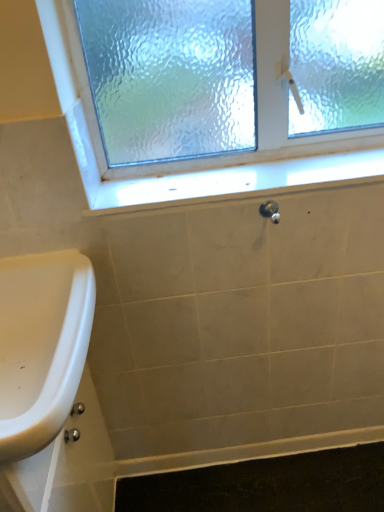
What are the coordinates of `frosted glass window at upper center` in the screenshot? It's located at (213, 158).

What do you see at coordinates (41, 345) in the screenshot?
I see `white glossy sink at lower left` at bounding box center [41, 345].

You are a GUI agent. You are given a task and a screenshot of the screen. Output one action in this format:
    pyautogui.click(x=<x>, y=<y>)
    Task: Click on the white glossy sink at lower left
    
    Given the screenshot: What is the action you would take?
    pyautogui.click(x=41, y=345)

Identify the location of black rubber bath mat at lower center. The height and width of the screenshot is (512, 384). (266, 485).

Is frosted glass window at upper center far away from black rubber bath mat at lower center?

That's right, there is a large distance between frosted glass window at upper center and black rubber bath mat at lower center.

Looking at this image, measure the distance from frosted glass window at upper center to black rubber bath mat at lower center.

They are 1.07 meters apart.

Considering the relative positions of frosted glass window at upper center and black rubber bath mat at lower center in the image provided, is frosted glass window at upper center to the left or to the right of black rubber bath mat at lower center?

frosted glass window at upper center is positioned on black rubber bath mat at lower center's left side.

In terms of height, does frosted glass window at upper center look taller or shorter compared to black rubber bath mat at lower center?

Clearly, frosted glass window at upper center is taller compared to black rubber bath mat at lower center.

Is white glossy sink at lower left completely or partially inside white glossy window sill at center?

No, white glossy sink at lower left is located outside of white glossy window sill at center.

How many degrees apart are the facing directions of white glossy window sill at center and white glossy sink at lower left?

90.4 degrees.

Considering the positions of objects white glossy window sill at center and white glossy sink at lower left in the image provided, who is more to the right, white glossy window sill at center or white glossy sink at lower left?

Positioned to the right is white glossy window sill at center.

Is black rubber bath mat at lower center touching white glossy window sill at center?

No, black rubber bath mat at lower center is not touching white glossy window sill at center.

In terms of size, does black rubber bath mat at lower center appear bigger or smaller than white glossy window sill at center?

Considering their sizes, black rubber bath mat at lower center takes up more space than white glossy window sill at center.

Considering the sizes of objects black rubber bath mat at lower center and white glossy window sill at center in the image provided, who is shorter, black rubber bath mat at lower center or white glossy window sill at center?

white glossy window sill at center is shorter.

Based on the photo, considering the sizes of satin nickel knob at center and frosted glass window at upper center in the image, is satin nickel knob at center bigger or smaller than frosted glass window at upper center?

satin nickel knob at center is smaller than frosted glass window at upper center.

From a real-world perspective, is satin nickel knob at center located higher than frosted glass window at upper center?

No, from a real-world perspective, satin nickel knob at center is not above frosted glass window at upper center.

From the image's perspective, between satin nickel knob at center and frosted glass window at upper center, who is located below?

satin nickel knob at center appears lower in the image.

Can you confirm if black rubber bath mat at lower center is wider than satin nickel knob at center?

Correct, the width of black rubber bath mat at lower center exceeds that of satin nickel knob at center.

Is black rubber bath mat at lower center turned away from satin nickel knob at center?

That's not correct — black rubber bath mat at lower center is not looking away from satin nickel knob at center.

Is point (230, 475) closer or farther from the camera than point (267, 214)?

Clearly, point (230, 475) is more distant from the camera than point (267, 214).

From their relative heights in the image, would you say black rubber bath mat at lower center is taller or shorter than satin nickel knob at center?

Clearly, black rubber bath mat at lower center is shorter compared to satin nickel knob at center.

From the image's perspective, is frosted glass window at upper center positioned above or below satin nickel knob at center?

Clearly, from the image's perspective, frosted glass window at upper center is above satin nickel knob at center.

How different are the orientations of frosted glass window at upper center and satin nickel knob at center in degrees?

The facing directions of frosted glass window at upper center and satin nickel knob at center are 1.35 degrees apart.

Is frosted glass window at upper center spatially inside satin nickel knob at center, or outside of it?

frosted glass window at upper center exists outside the volume of satin nickel knob at center.

Considering the sizes of objects satin nickel knob at center and white glossy sink at lower left in the image provided, who is bigger, satin nickel knob at center or white glossy sink at lower left?

white glossy sink at lower left is bigger.

Looking at this image, do you think satin nickel knob at center is within white glossy sink at lower left, or outside of it?

satin nickel knob at center cannot be found inside white glossy sink at lower left.

How different are the orientations of satin nickel knob at center and white glossy sink at lower left in degrees?

91.6 degrees.

From a real-world perspective, between satin nickel knob at center and white glossy sink at lower left, who is vertically lower?

In real-world perspective, white glossy sink at lower left is lower.

Locate an element on the screen. The height and width of the screenshot is (512, 384). bath mat lying on the right of frosted glass window at upper center is located at coordinates (266, 485).

I want to click on sink in front of the white glossy window sill at center, so click(41, 345).

Considering their positions, is frosted glass window at upper center positioned further to black rubber bath mat at lower center than satin nickel knob at center?

The object further to black rubber bath mat at lower center is frosted glass window at upper center.

Estimate the real-world distances between objects in this image. Which object is further from white glossy sink at lower left, frosted glass window at upper center or black rubber bath mat at lower center?

Among the two, black rubber bath mat at lower center is located further to white glossy sink at lower left.

Considering their positions, is satin nickel knob at center positioned further to white glossy window sill at center than frosted glass window at upper center?

satin nickel knob at center is further to white glossy window sill at center.

Looking at this image, based on their spatial positions, is satin nickel knob at center or white glossy window sill at center further from black rubber bath mat at lower center?

white glossy window sill at center is further to black rubber bath mat at lower center.

Considering their positions, is white glossy window sill at center positioned further to satin nickel knob at center than white glossy sink at lower left?

Among the two, white glossy sink at lower left is located further to satin nickel knob at center.

From the image, which object appears to be farther from frosted glass window at upper center, white glossy sink at lower left or satin nickel knob at center?

white glossy sink at lower left is further to frosted glass window at upper center.

Considering their positions, is satin nickel knob at center positioned further to frosted glass window at upper center than black rubber bath mat at lower center?

black rubber bath mat at lower center is further to frosted glass window at upper center.

Looking at the image, which one is located further to white glossy sink at lower left, frosted glass window at upper center or satin nickel knob at center?

The object further to white glossy sink at lower left is satin nickel knob at center.

Where is `plumbing fixture that lies between frosted glass window at upper center and black rubber bath mat at lower center from top to bottom`? The image size is (384, 512). plumbing fixture that lies between frosted glass window at upper center and black rubber bath mat at lower center from top to bottom is located at coordinates (270, 210).

I want to click on window sill situated between white glossy sink at lower left and satin nickel knob at center from left to right, so click(237, 182).

At what (x,y) coordinates should I click in order to perform the action: click on plumbing fixture between white glossy window sill at center and black rubber bath mat at lower center in the up-down direction. Please return your answer as a coordinate pair (x, y). The height and width of the screenshot is (512, 384). Looking at the image, I should click on (270, 210).

I want to click on sink between satin nickel knob at center and black rubber bath mat at lower center from top to bottom, so click(41, 345).